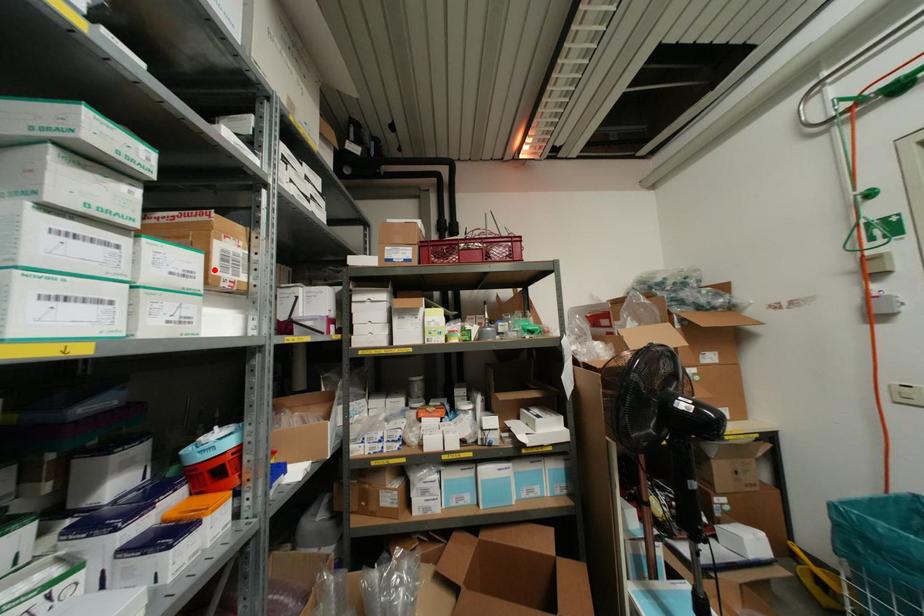
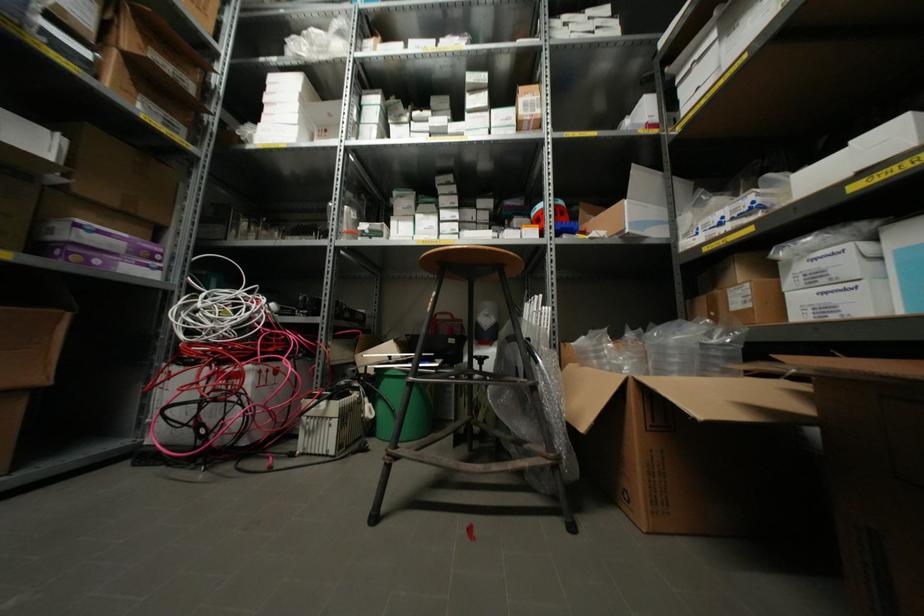
Locate, in the second image, the point that corresponds to the highlighted location in the first image.

(519, 111)